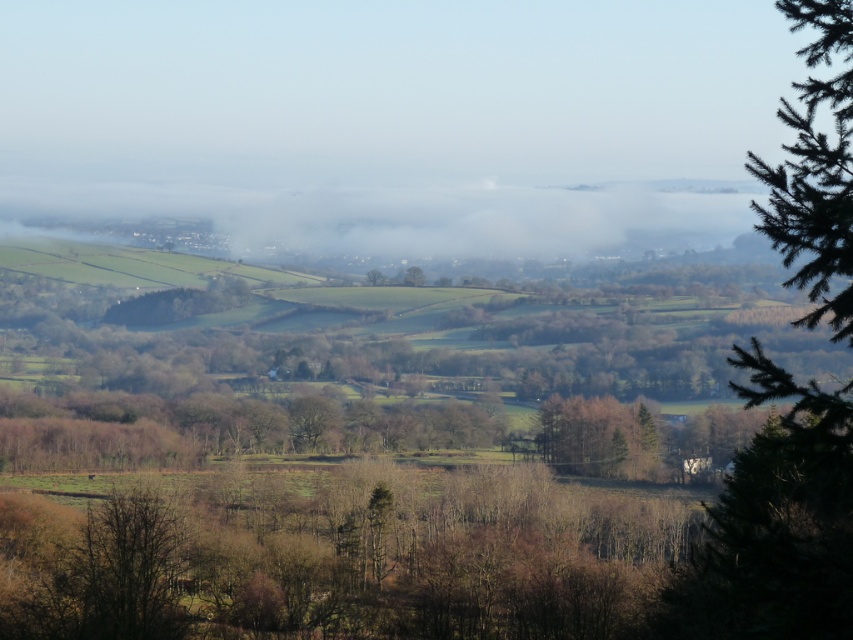
You are a hiker standing at the top of a hill overlooking the scene. You notice two trees at the center of the landscape. Which tree is positioned lower in the image? The brown matte tree at center or the green leafy tree at center?

The brown matte tree at center is positioned below the green leafy tree at center, so the brown matte tree at center is lower in the image.

You are a surveyor measuring distances between landmarks in the rural landscape. You have a measuring tape that can extend up to 250 feet. You need to measure the distance between the brown matte tree at center and another tree in the foreground. Can your measuring tape reach that distance?

The distance between the brown matte tree at center and the other tree is 267.14 feet, which exceeds the measuring tape capacity of 250 feet. Therefore, the measuring tape cannot reach the required distance.